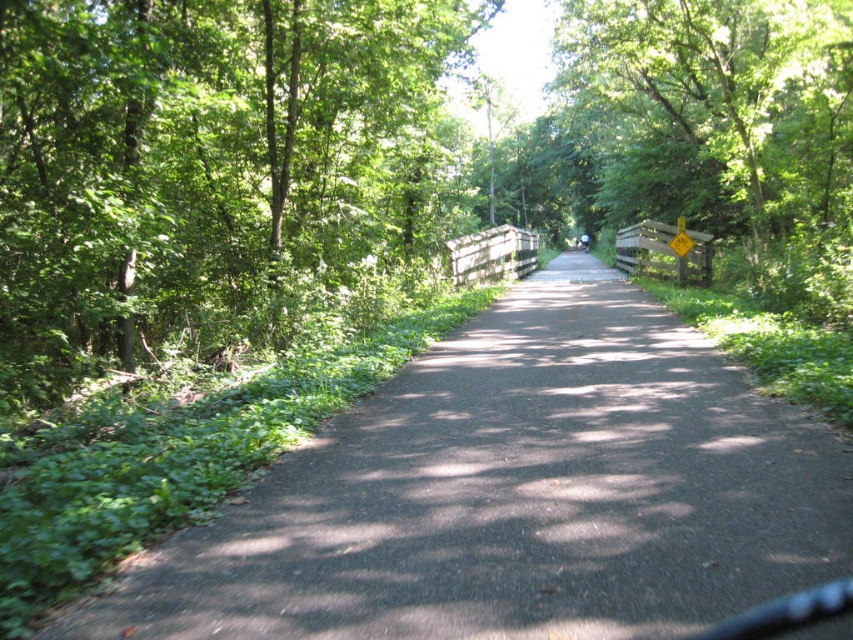
You are a hiker carrying a 20 feet long tent pole. You want to set up your tent between the black asphalt path at center and the green leafy tree at left. Can you fit the tent pole horizontally between them without bending it?

The distance between the black asphalt path at center and the green leafy tree at left is 19.07 feet, which is shorter than the 20 feet long tent pole. Therefore, you cannot fit the tent pole horizontally between them without bending it.

You are standing at the starting point of the trail and want to reach the black asphalt path at center. Which direction should you walk to reach it?

Since the black asphalt path at center is located at point (515, 493), you should walk forward along the path towards the center to reach it.